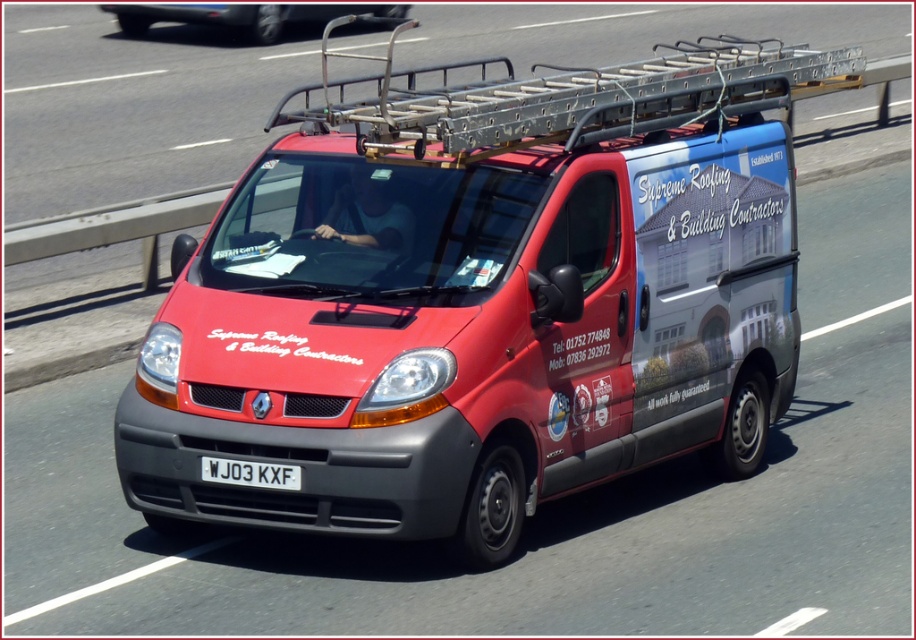
Question: Which of the following is the closest to the observer?

Choices:
 (A) pos(267,467)
 (B) pos(679,260)

Answer: (A)

Question: Which point appears closest to the camera in this image?

Choices:
 (A) (211, 3)
 (B) (197, 456)

Answer: (B)

Question: Can you confirm if matte red van at center is positioned to the right of metallic silver van at center?

Choices:
 (A) no
 (B) yes

Answer: (B)

Question: Is matte red van at center thinner than metallic silver van at center?

Choices:
 (A) no
 (B) yes

Answer: (B)

Question: From the image, what is the correct spatial relationship of matte red van at center in relation to metallic silver van at center?

Choices:
 (A) right
 (B) left

Answer: (A)

Question: Which point appears farthest from the camera in this image?

Choices:
 (A) (238, 468)
 (B) (183, 12)
 (C) (449, 365)

Answer: (B)